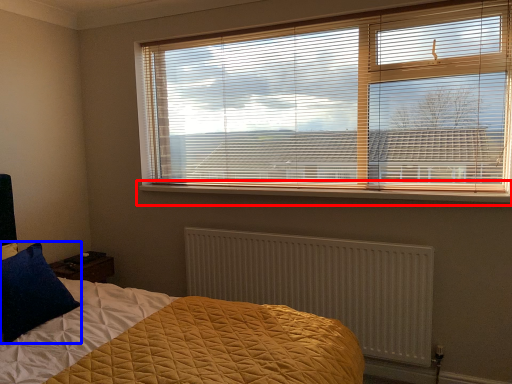
Question: Which point is further to the camera, window sill (highlighted by a red box) or pillow (highlighted by a blue box)?

Choices:
 (A) window sill
 (B) pillow

Answer: (A)